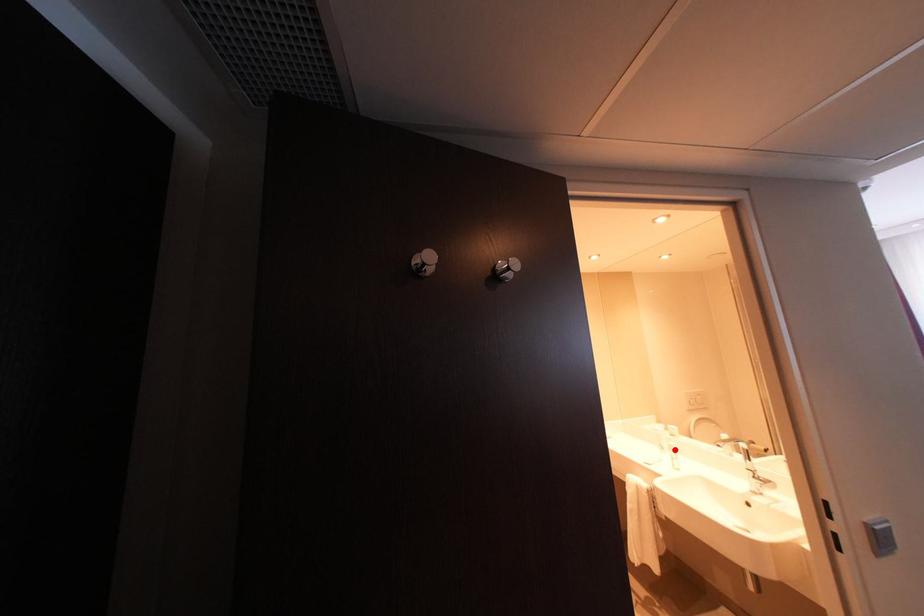
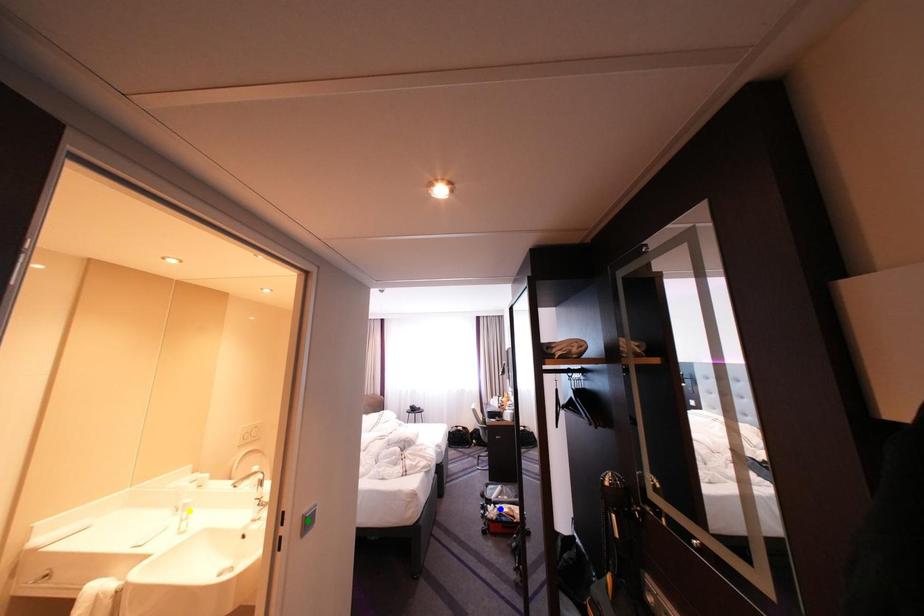
Question: I am providing you with two images of the same scene from different viewpoints. A red point is marked on the first image. You are given multiple points on the second image. Which spot in image 2 lines up with the point in image 1?

Choices:
 (A) blue point
 (B) green point
 (C) yellow point

Answer: (C)